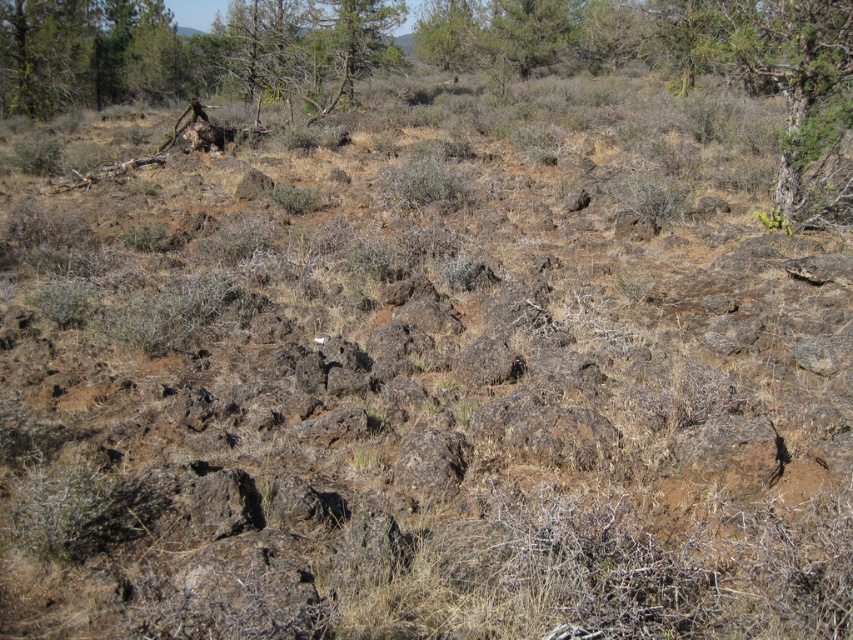
You are a hiker planning to set up a tent in this rugged landscape. You see the smooth bark tree at upper right and the brown bark tree at upper left. Which tree would provide more shade if you place your tent near it?

The smooth bark tree at upper right is bigger than the brown bark tree at upper left, so it would provide more shade for your tent.

You are standing at the point with coordinates point (372,8) and want to walk to the point with coordinates point (798,200). Which direction should you move in relation to the landscape?

You should move forward because point (798,200) is in front of point (372,8).